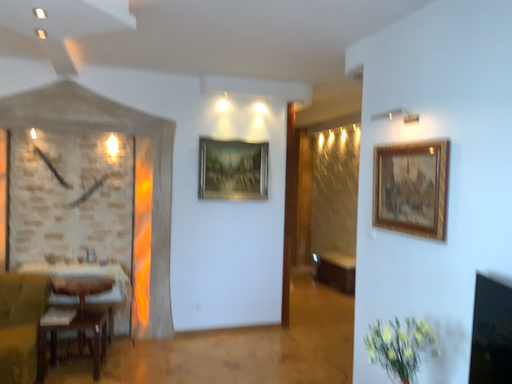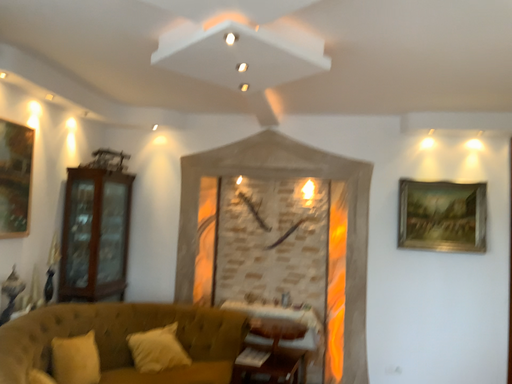
Question: How did the camera likely rotate when shooting the video?

Choices:
 (A) rotated upward
 (B) rotated downward

Answer: (A)